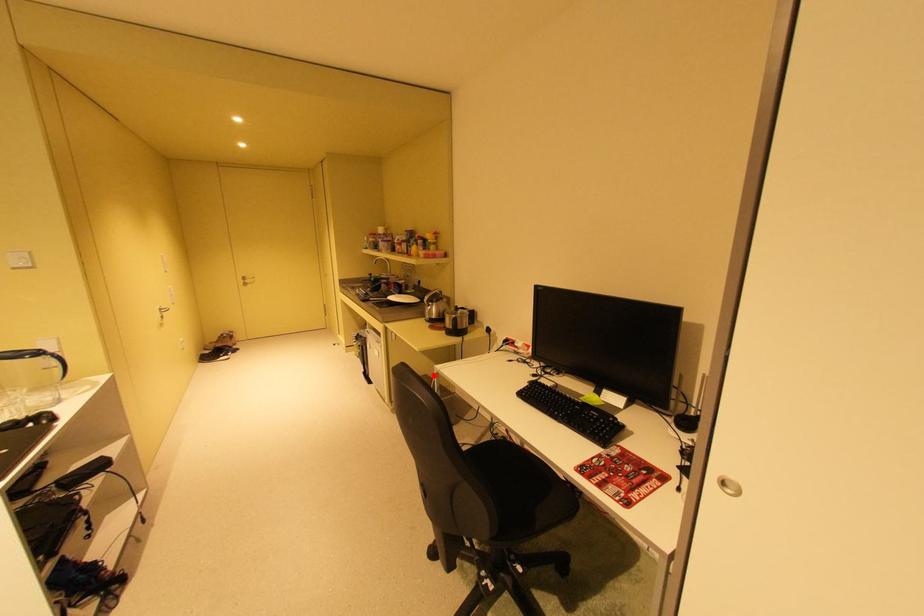
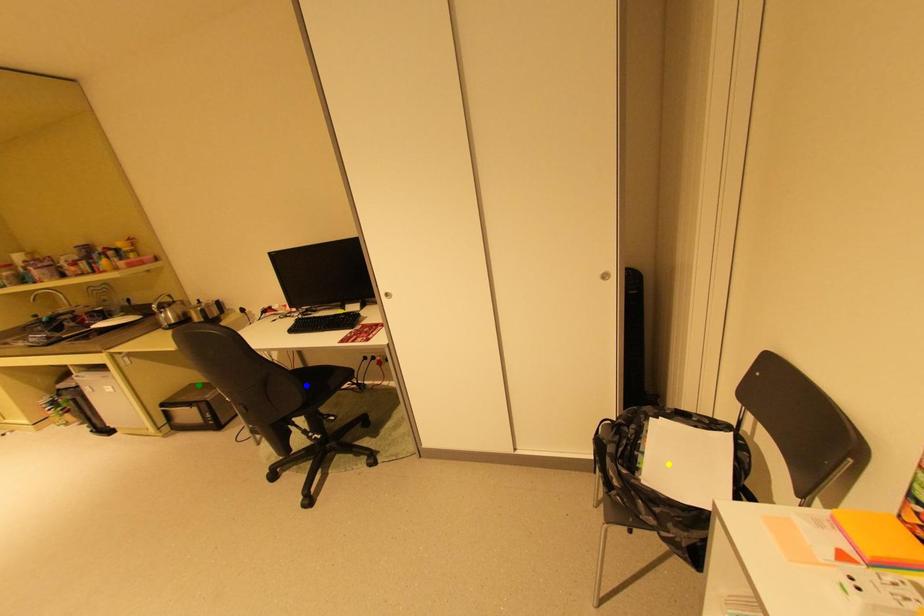
Question: I am providing you with two images of the same scene from different viewpoints. A red point is marked on the first image. You are given multiple points on the second image. Which point in image 2 is actually the same real-world point as the red point in image 1?

Choices:
 (A) blue point
 (B) yellow point
 (C) green point

Answer: (C)